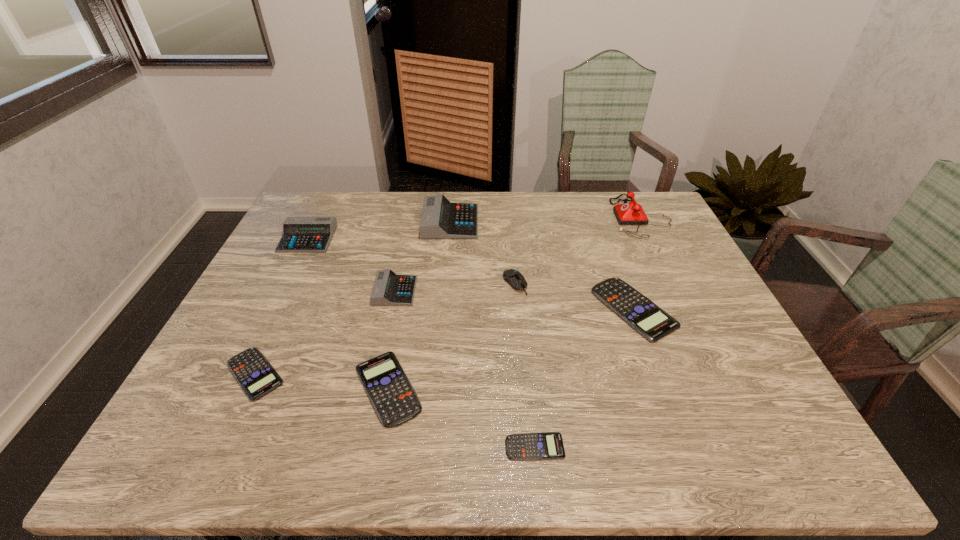
You are a GUI agent. You are given a task and a screenshot of the screen. Output one action in this format:
    pyautogui.click(x=<x>, y=<y>)
    Task: Click on the calculator at the right edge
    
    Given the screenshot: What is the action you would take?
    click(x=653, y=323)

Where is `object that is at the far left corner`? The width and height of the screenshot is (960, 540). object that is at the far left corner is located at coordinates (299, 234).

Identify the location of object that is at the far right corner. (632, 213).

This screenshot has height=540, width=960. Find the location of `free region at the far edge of the desktop`. free region at the far edge of the desktop is located at coordinates (491, 208).

Where is `free point at the near edge`? The height and width of the screenshot is (540, 960). free point at the near edge is located at coordinates (321, 461).

Where is `vacant space in between the shortest object and the biggest blue calculator`? Image resolution: width=960 pixels, height=540 pixels. vacant space in between the shortest object and the biggest blue calculator is located at coordinates (585, 378).

In order to click on free space between the nearest gray calculator and the third tallest object in this screenshot , I will do `click(351, 265)`.

Identify the location of free point between the second shortest object and the computer mouse. (385, 329).

Identify the location of unoccupied position between the third tallest calculator and the nearest blue calculator. (465, 369).

The height and width of the screenshot is (540, 960). I want to click on free space between the smallest gray calculator and the telephone, so 517,254.